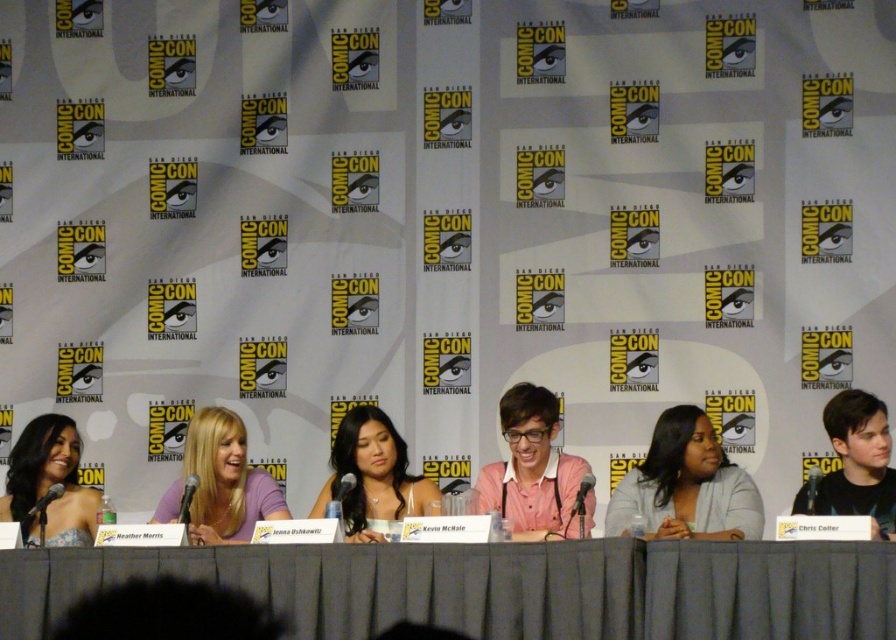
You are attending Comic Con and want to identify the clothing items on the panelists. Which clothing item, the smooth gray blazer at center or the smooth white blouse at center, is taller?

The smooth gray blazer at center is taller than the smooth white blouse at center.

You are attending Comic Con and want to take a photo with the panelist wearing the smooth gray blazer at center and the panelist in the smooth black shirt at right. Since you can only take one photo, which panelist should you approach first to ensure you can capture both in a single frame?

You should approach the panelist in the smooth black shirt at right first because the smooth gray blazer at center is below it, so positioning yourself closer to the smooth black shirt at right will allow you to include both in your photo frame.